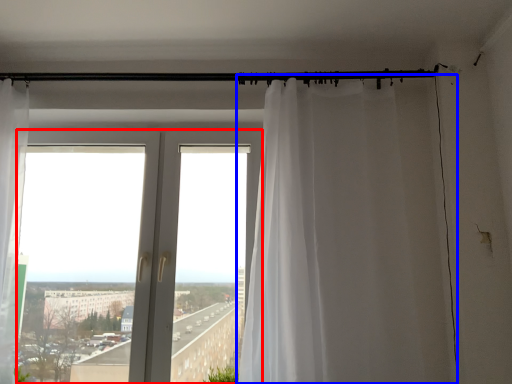
Question: Among these objects, which one is nearest to the camera, window (highlighted by a red box) or curtain (highlighted by a blue box)?

Choices:
 (A) window
 (B) curtain

Answer: (B)